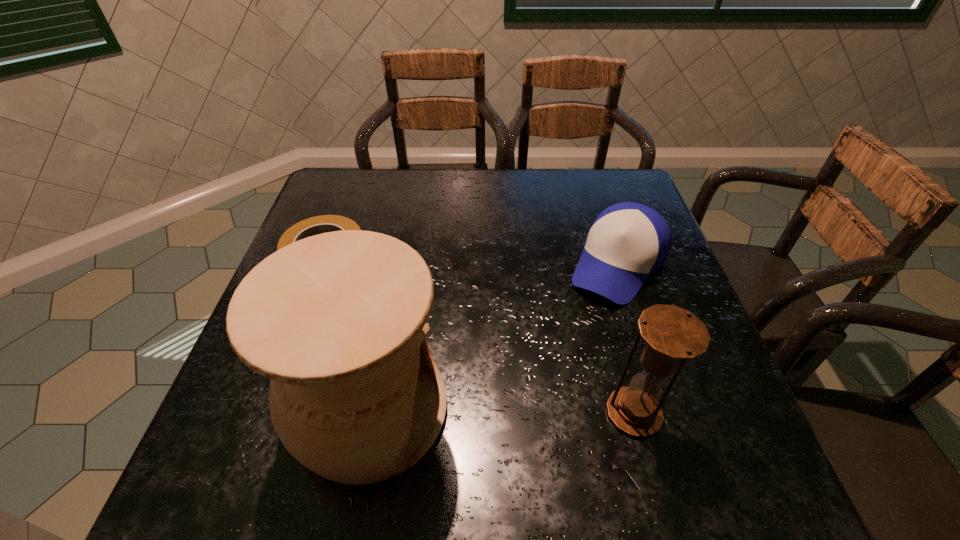
This screenshot has width=960, height=540. Find the location of `vacant area that lies between the hourglass and the baseball cap`. vacant area that lies between the hourglass and the baseball cap is located at coordinates (626, 339).

The image size is (960, 540). I want to click on vacant region between the third shortest object and the tallest object, so click(502, 411).

The height and width of the screenshot is (540, 960). I want to click on vacant space that's between the hourglass and the pottery, so click(x=502, y=411).

This screenshot has width=960, height=540. In order to click on empty space that is in between the baseball cap and the pottery in this screenshot , I will do `click(494, 338)`.

Point out which object is positioned as the nearest to the baseball cap. Please provide its 2D coordinates. Your answer should be formatted as a tuple, i.e. [(x, y)], where the tuple contains the x and y coordinates of a point satisfying the conditions above.

[(671, 333)]

Select which object appears as the third closest to the shortest object. Please provide its 2D coordinates. Your answer should be formatted as a tuple, i.e. [(x, y)], where the tuple contains the x and y coordinates of a point satisfying the conditions above.

[(671, 333)]

In order to click on free space that satisfies the following two spatial constraints: 1. on the front side of the duct tape; 2. at the open side of the tallest object in this screenshot , I will do `click(275, 410)`.

Find the location of a particular element. vacant space that satisfies the following two spatial constraints: 1. on the front side of the shortest object; 2. at the open side of the tallest object is located at coordinates (275, 410).